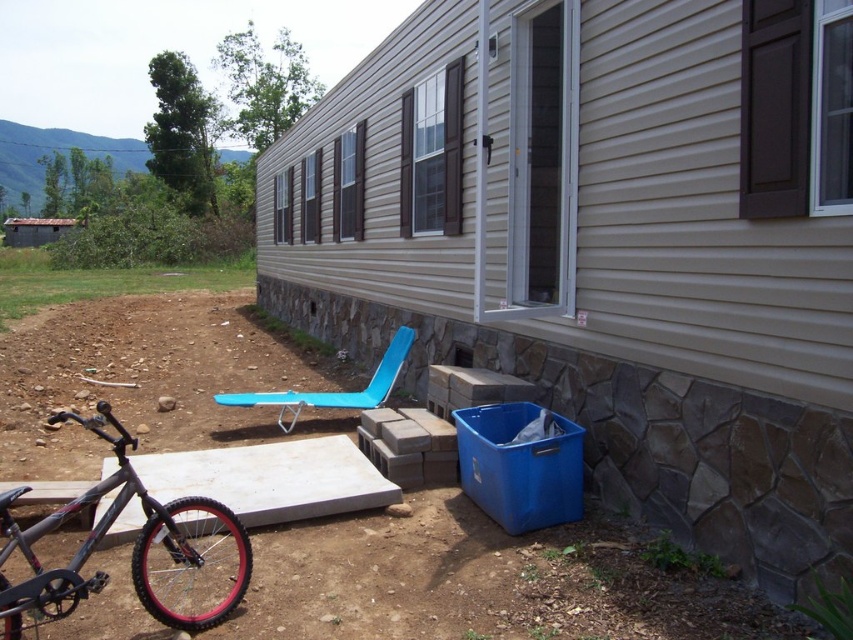
Question: Which object appears closest to the camera in this image?

Choices:
 (A) blue plastic beach chair at lower center
 (B) shiny black frame at lower left

Answer: (B)

Question: Is shiny black frame at lower left positioned in front of blue plastic beach chair at lower center?

Choices:
 (A) yes
 (B) no

Answer: (A)

Question: Is the position of shiny black frame at lower left more distant than that of blue plastic beach chair at lower center?

Choices:
 (A) yes
 (B) no

Answer: (B)

Question: Observing the image, what is the correct spatial positioning of shiny black frame at lower left in reference to blue plastic beach chair at lower center?

Choices:
 (A) right
 (B) left

Answer: (B)

Question: Which of the following is the farthest from the observer?

Choices:
 (A) (106, 420)
 (B) (402, 349)

Answer: (A)